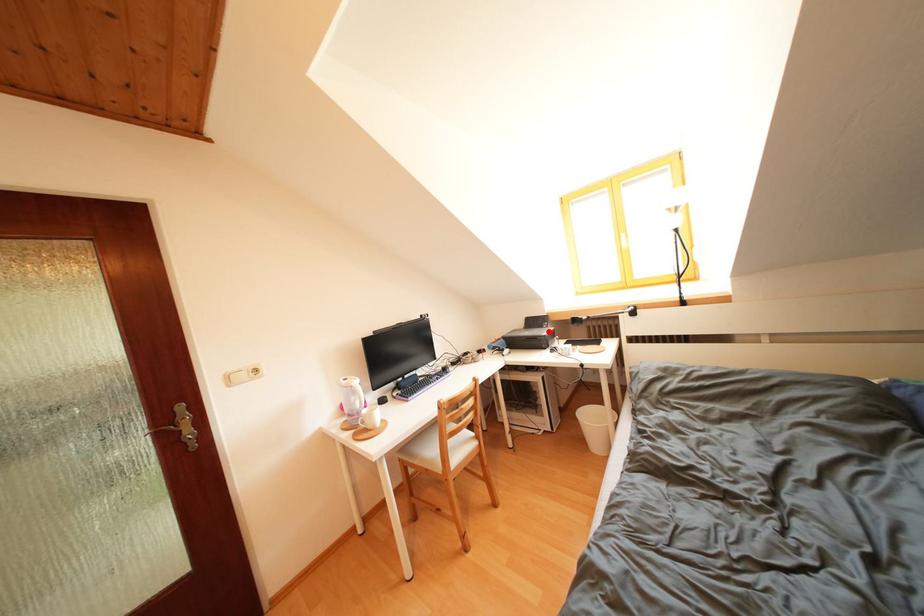
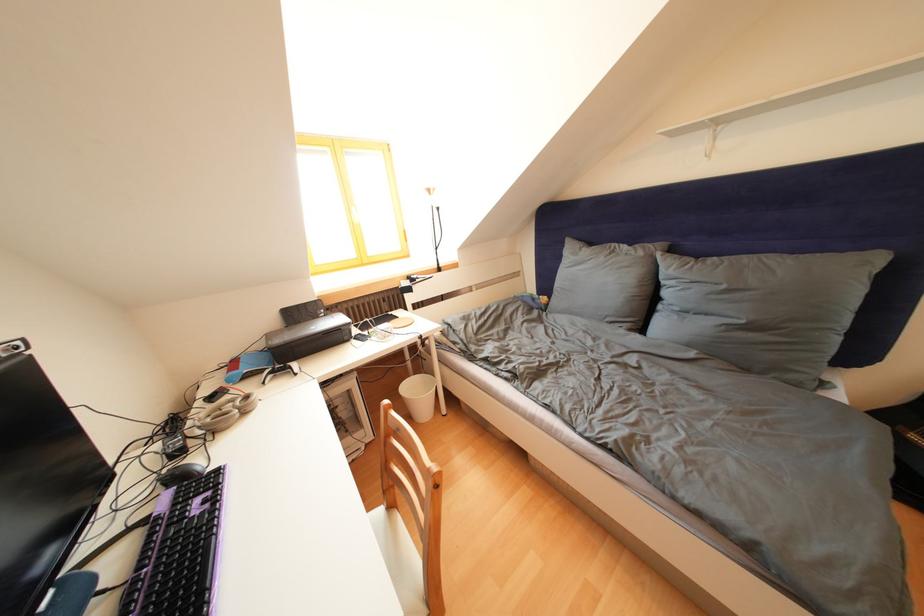
Where in the second image is the point corresponding to the highlighted location from the first image?

(323, 322)